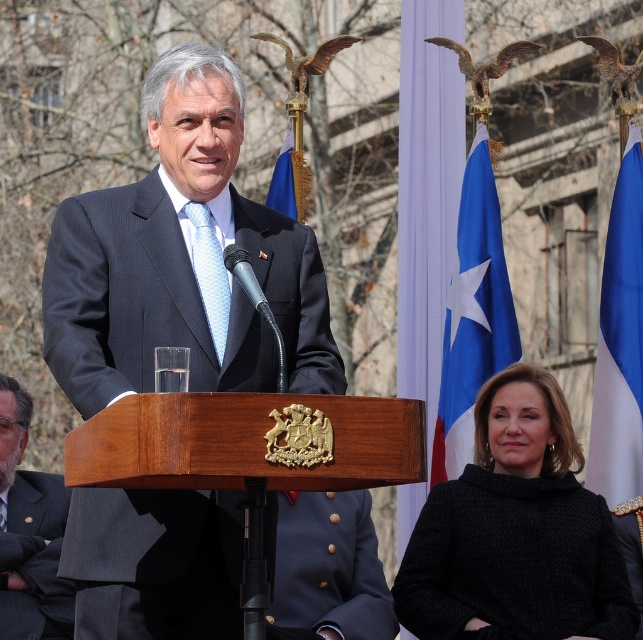
You are an event planner organizing a photo shoot for the event. You need to ensure that the navy blue fabric at lower center and the light blue textured tie at center are visible in the photo. Given their sizes, which object should be placed closer to the camera to maintain visibility?

Since the navy blue fabric at lower center has a lesser width compared to the light blue textured tie at center, it should be placed closer to the camera to ensure its visibility matches that of the larger object.

You are an event planner arranging seating for a formal dinner. You need to seat guests according to their positions relative to the speaker during the event. The speaker is wearing a dark gray suit at center. There is also a navy blue fabric at lower center. Which guest should sit to the left of the speaker based on their position during the event?

The navy blue fabric at lower center is to the right of the dark gray suit at center, so the guest wearing or associated with the navy blue fabric should sit to the right of the speaker, not the left. Therefore, no guest should be seated to the left of the speaker based on their current positions during the event.